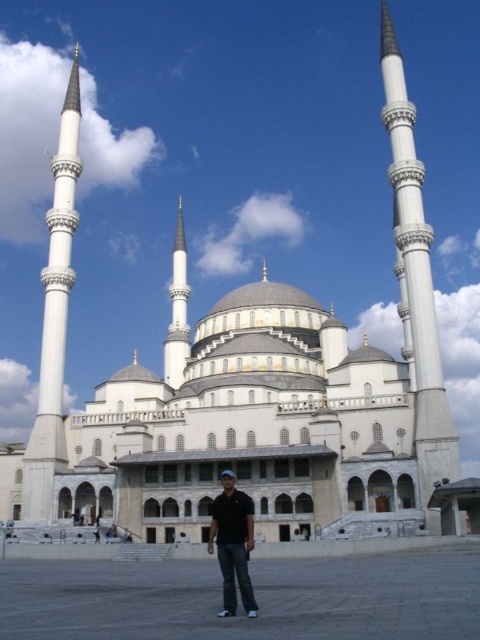
Does white marble minaret at right have a greater height compared to black matte shirt at center?

Correct, white marble minaret at right is much taller as black matte shirt at center.

Who is shorter, white marble minaret at right or black matte shirt at center?

With less height is black matte shirt at center.

Locate an element on the screen. Image resolution: width=480 pixels, height=640 pixels. white marble minaret at right is located at coordinates (416, 278).

Image resolution: width=480 pixels, height=640 pixels. Find the location of `white marble minaret at right`. white marble minaret at right is located at coordinates (416, 278).

Between white marble minaret at left and black matte shirt at center, which one has more height?

Standing taller between the two is white marble minaret at left.

Looking at this image, does white marble minaret at left have a smaller size compared to black matte shirt at center?

No, white marble minaret at left is not smaller than black matte shirt at center.

At what (x,y) coordinates should I click in order to perform the action: click on white marble minaret at left. Please return your answer as a coordinate pair (x, y). The width and height of the screenshot is (480, 640). Looking at the image, I should click on (55, 317).

Find the location of `white marble minaret at left`. white marble minaret at left is located at coordinates (55, 317).

Can you confirm if white marble minaret at right is positioned below white marble minaret at left?

Incorrect, white marble minaret at right is not positioned below white marble minaret at left.

Does white marble minaret at right appear on the right side of white marble minaret at left?

Correct, you'll find white marble minaret at right to the right of white marble minaret at left.

What do you see at coordinates (416, 278) in the screenshot? The image size is (480, 640). I see `white marble minaret at right` at bounding box center [416, 278].

Identify the location of white marble minaret at right. (416, 278).